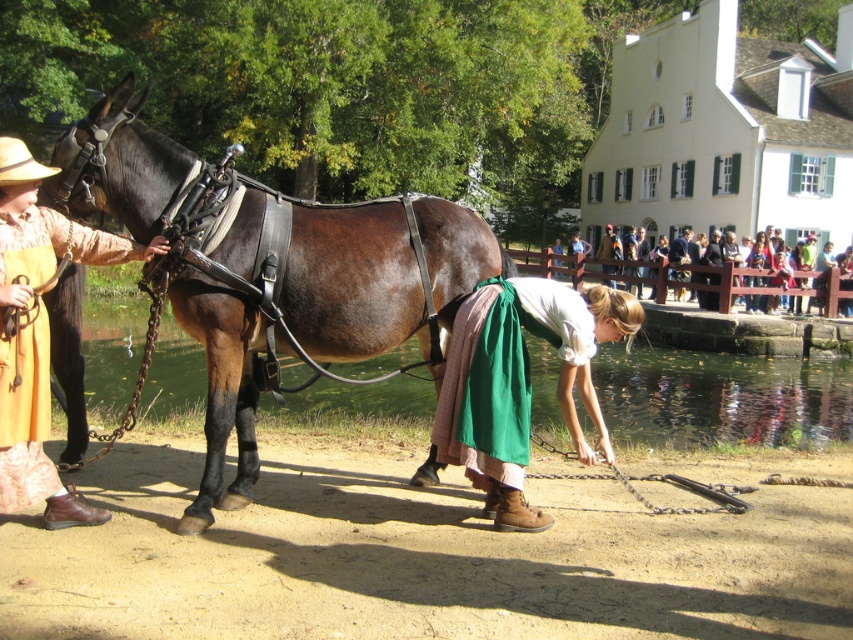
Who is higher up, shiny brown leather harness at center or green fabric skirt at lower center?

shiny brown leather harness at center is above.

Who is positioned more to the right, shiny brown leather harness at center or green fabric skirt at lower center?

green fabric skirt at lower center is more to the right.

Based on the photo, who is more forward, (x=312, y=212) or (x=515, y=288)?

Point (x=515, y=288)

You are a GUI agent. You are given a task and a screenshot of the screen. Output one action in this format:
    pyautogui.click(x=<x>, y=<y>)
    Task: Click on the shiny brown leather harness at center
    
    Given the screenshot: What is the action you would take?
    pyautogui.click(x=352, y=282)

Does shiny brown leather harness at center appear on the left side of matte yellow apron at left?

In fact, shiny brown leather harness at center is to the right of matte yellow apron at left.

Based on the photo, who is more forward, (378, 339) or (22, 384)?

Point (22, 384) is more forward.

Which is behind, point (85, 156) or point (45, 344)?

The point (85, 156) is behind.

I want to click on shiny brown leather harness at center, so click(x=352, y=282).

Is green fabric skirt at lower center taller than matte yellow apron at left?

No, green fabric skirt at lower center is not taller than matte yellow apron at left.

Who is shorter, green fabric skirt at lower center or matte yellow apron at left?

green fabric skirt at lower center

You are a GUI agent. You are given a task and a screenshot of the screen. Output one action in this format:
    pyautogui.click(x=<x>, y=<y>)
    Task: Click on the green fabric skirt at lower center
    
    Given the screenshot: What is the action you would take?
    pyautogui.click(x=519, y=381)

Locate an element on the screen. The image size is (853, 640). green fabric skirt at lower center is located at coordinates (519, 381).